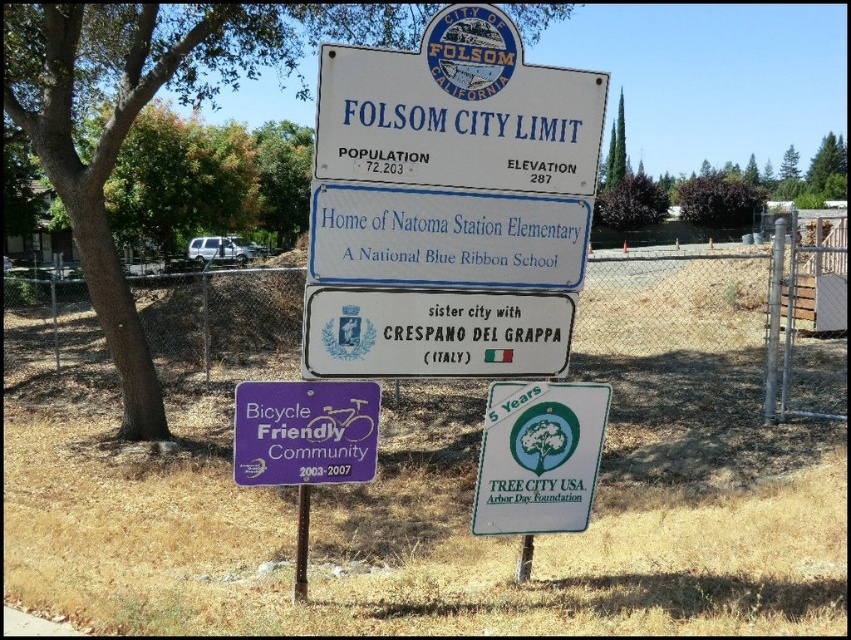
Question: Which object is closer to the camera taking this photo?

Choices:
 (A) metal chain-link fence at center
 (B) white metallic sign at center
 (C) metallic pole at center
 (D) purple plastic bicycle friendly community sign at lower center

Answer: (B)

Question: Which point is farther from the camera taking this photo?

Choices:
 (A) (590, 490)
 (B) (14, 307)
 (C) (298, 532)
 (D) (426, 355)

Answer: (B)

Question: Among these objects, which one is farthest from the camera?

Choices:
 (A) metal chain-link fence at center
 (B) purple plastic bicycle friendly community sign at lower center

Answer: (B)

Question: Does white metallic sign at center have a lesser width compared to metallic pole at center?

Choices:
 (A) no
 (B) yes

Answer: (A)

Question: Does green paper sign at lower right appear on the right side of metallic pole at center?

Choices:
 (A) no
 (B) yes

Answer: (B)

Question: Does green paper sign at lower right appear on the left side of metallic pole at center?

Choices:
 (A) no
 (B) yes

Answer: (A)